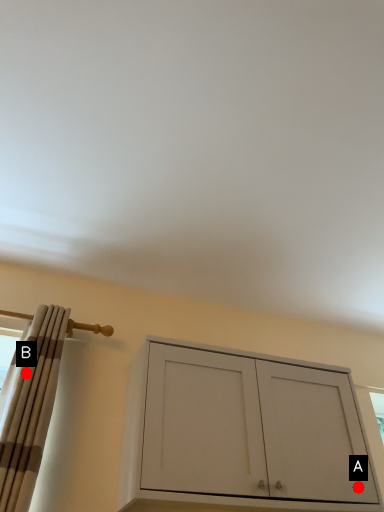
Question: Two points are circled on the image, labeled by A and B beside each circle. Among these points, which one is farthest from the camera?

Choices:
 (A) A is further
 (B) B is further

Answer: (A)